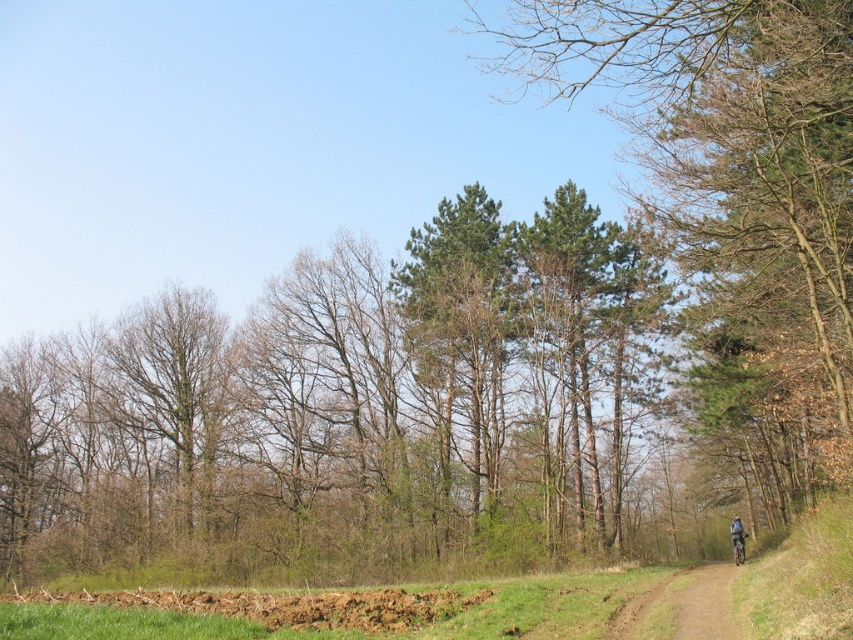
Is point (804, 70) less distant than point (740, 557)?

Yes, it is.

Can you confirm if green leafy tree at center is taller than shiny blue frame at right?

Yes.

Between point (711, 349) and point (744, 557), which one is positioned in front?

Positioned in front is point (711, 349).

You are a GUI agent. You are given a task and a screenshot of the screen. Output one action in this format:
    pyautogui.click(x=<x>, y=<y>)
    Task: Click on the green leafy tree at center
    The width and height of the screenshot is (853, 640).
    Given the screenshot: What is the action you would take?
    pyautogui.click(x=734, y=205)

Can you confirm if brown dirt track at lower right is positioned to the left of shiny blue frame at right?

Yes, brown dirt track at lower right is to the left of shiny blue frame at right.

Is brown dirt track at lower right smaller than shiny blue frame at right?

Actually, brown dirt track at lower right might be larger than shiny blue frame at right.

Is point (729, 608) positioned before point (733, 536)?

Yes.

Find the location of a particular element. brown dirt track at lower right is located at coordinates (682, 605).

Can you confirm if green leafy tree at center is smaller than brown dirt track at lower right?

No, green leafy tree at center is not smaller than brown dirt track at lower right.

Can you confirm if green leafy tree at center is positioned to the left of brown dirt track at lower right?

In fact, green leafy tree at center is to the right of brown dirt track at lower right.

What do you see at coordinates (734, 205) in the screenshot?
I see `green leafy tree at center` at bounding box center [734, 205].

Where is `green leafy tree at center`? The image size is (853, 640). green leafy tree at center is located at coordinates (734, 205).